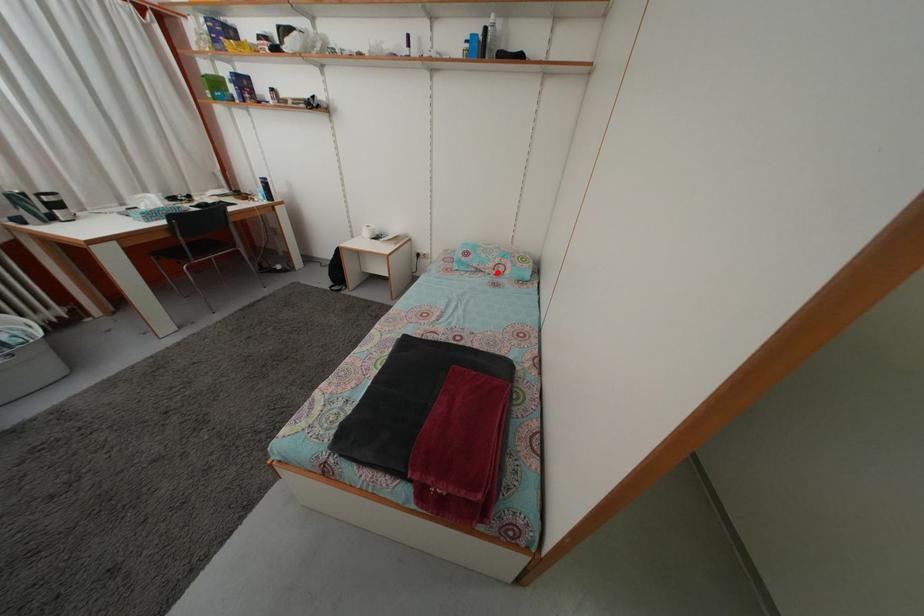
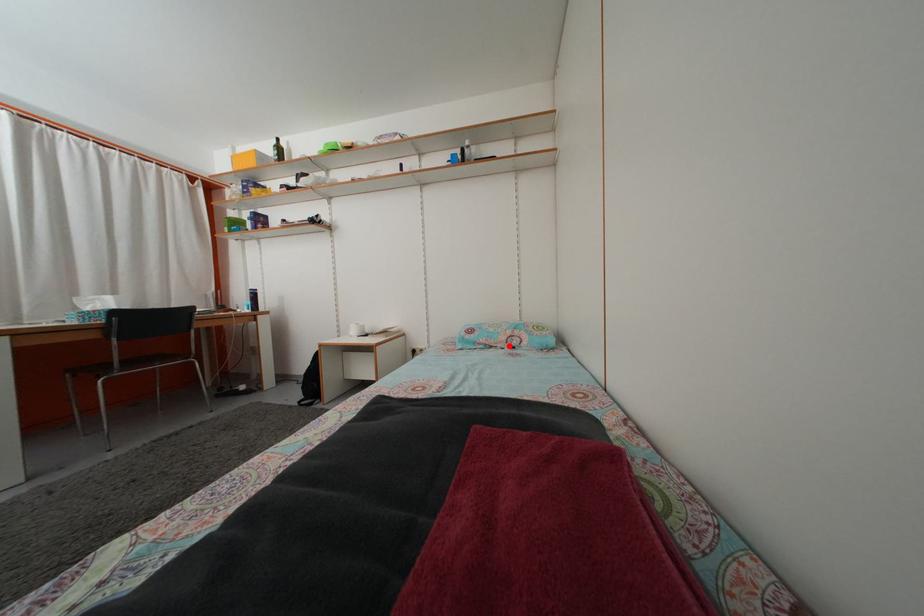
I am providing you with two images of the same scene from different viewpoints. A red point is marked on the first image and another point is marked on the second image. Does the point marked in image1 correspond to the same location as the one in image2?

Yes